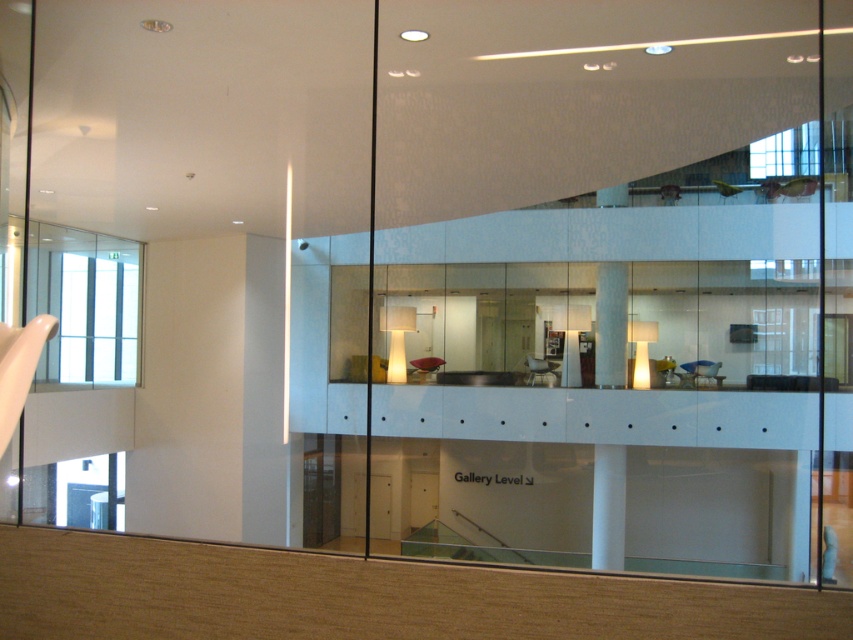
Question: Can you confirm if white glossy balustrade at center is smaller than white glossy pillar at center?

Choices:
 (A) yes
 (B) no

Answer: (A)

Question: Which of the following is the farthest from the observer?

Choices:
 (A) white glossy pillar at center
 (B) transparent glass at upper center
 (C) white glossy balustrade at center

Answer: (A)

Question: Which point is farther to the camera?

Choices:
 (A) transparent glass at upper center
 (B) white glossy pillar at center

Answer: (B)

Question: Does white glossy balustrade at center have a lesser width compared to white glossy pillar at center?

Choices:
 (A) yes
 (B) no

Answer: (A)

Question: Which object appears farthest from the camera in this image?

Choices:
 (A) transparent glass at upper center
 (B) white glossy balustrade at center
 (C) white glossy pillar at center

Answer: (C)

Question: Can you confirm if transparent glass at upper center is positioned to the right of white glossy pillar at center?

Choices:
 (A) no
 (B) yes

Answer: (A)